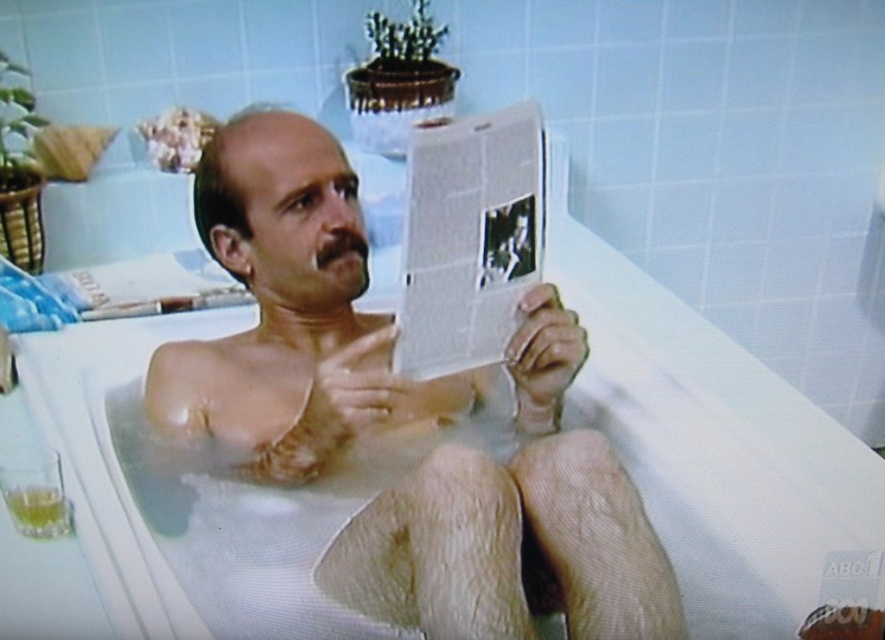
You are a photographer trying to capture the man in the bathtub while ensuring the newspaper remains visible in the background. Based on their positions, can you position yourself so that both the smooth skin man at center and the white glossy newspaper at center are clearly visible in the same frame?

The smooth skin man at center is in front of the white glossy newspaper at center, so positioning yourself behind the man will allow you to see both the smooth skin man at center and the white glossy newspaper at center in the same frame.

Based on the scene described, can you determine which object is larger between the smooth skin man at center and the white glossy newspaper at center?

The smooth skin man at center is bigger than the white glossy newspaper at center according to the description.